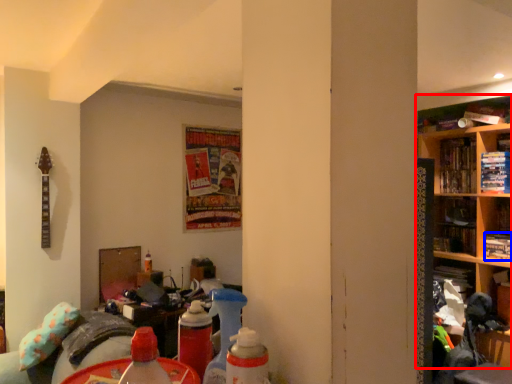
Question: Which of the following is the farthest to the observer, shelf (highlighted by a red box) or book (highlighted by a blue box)?

Choices:
 (A) shelf
 (B) book

Answer: (B)